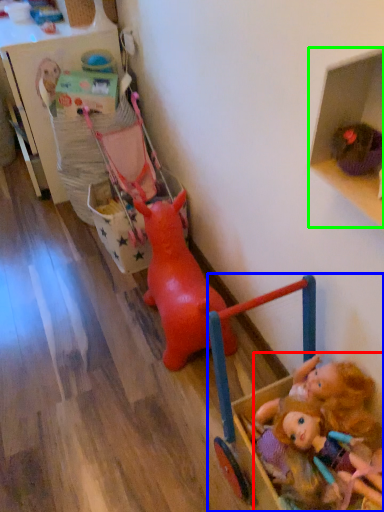
Question: Considering the real-world distances, which object is farthest from person (highlighted by a red box)? toy (highlighted by a blue box) or shelf (highlighted by a green box)?

Choices:
 (A) toy
 (B) shelf

Answer: (B)